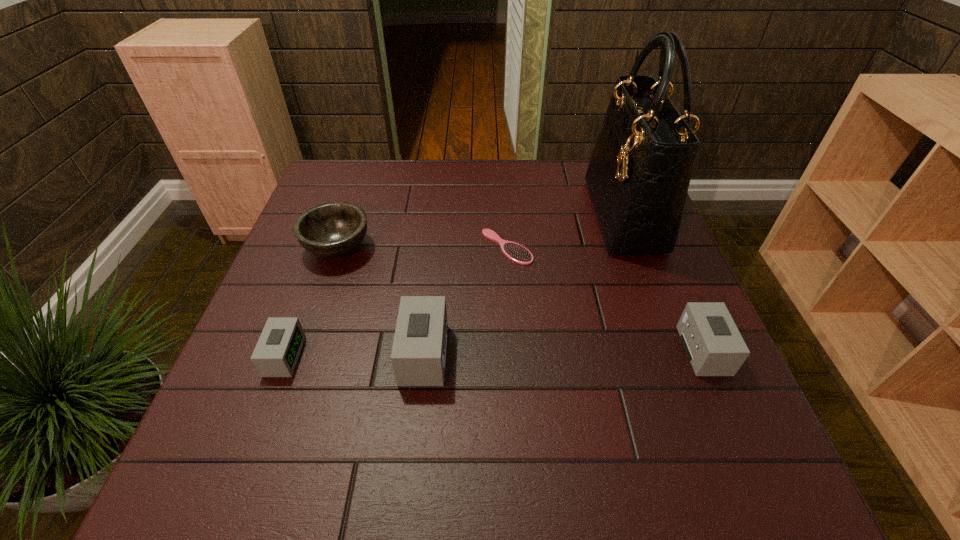
Find the location of a particular element. Image resolution: width=960 pixels, height=540 pixels. the fifth tallest object is located at coordinates (277, 351).

Locate an element on the screen. This screenshot has width=960, height=540. the leftmost alarm clock is located at coordinates (277, 351).

Identify the location of the fourth object from right to left. (419, 351).

This screenshot has width=960, height=540. Find the location of `the second tallest object`. the second tallest object is located at coordinates (419, 351).

Locate an element on the screen. the second shortest alarm clock is located at coordinates coord(713,344).

This screenshot has height=540, width=960. In order to click on handbag in this screenshot , I will do `click(639, 173)`.

Find the location of `the fourth object from left to right`. the fourth object from left to right is located at coordinates (517, 253).

Where is `hairbrush`? Image resolution: width=960 pixels, height=540 pixels. hairbrush is located at coordinates (517, 253).

The height and width of the screenshot is (540, 960). I want to click on bowl, so click(334, 229).

Identify the location of vacant space positioned 0.400m on the front-facing side of the second shortest object. (496, 356).